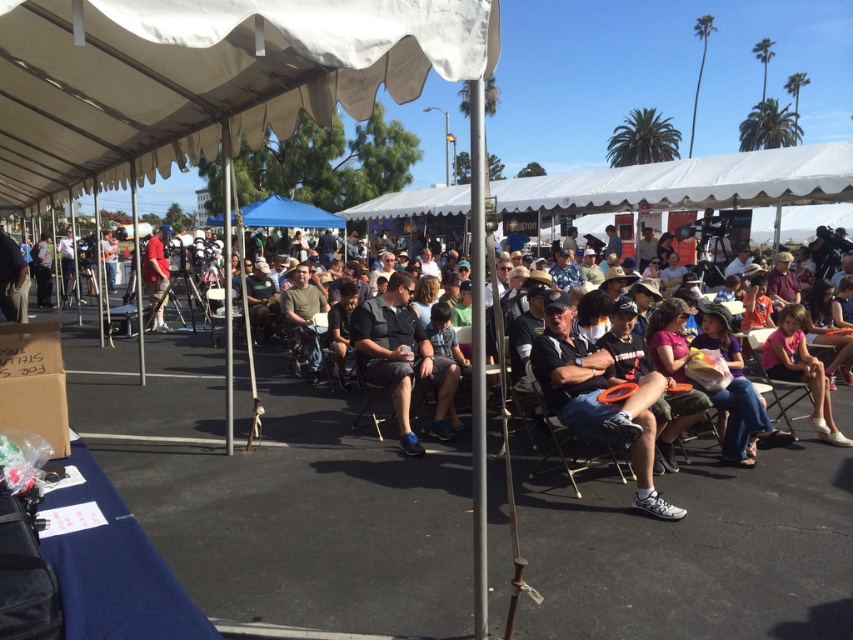
Describe the element at coordinates (401, 356) in the screenshot. I see `dark gray fabric shirt at center` at that location.

Does dark gray fabric shirt at center have a lesser width compared to pink fabric dress at center?

In fact, dark gray fabric shirt at center might be wider than pink fabric dress at center.

Which is in front, point (444, 435) or point (782, 336)?

Point (444, 435) is more forward.

I want to click on dark gray fabric shirt at center, so point(401,356).

Is pink fabric dress at center wider than matte red shirt at center?

No.

Is point (822, 426) positioned before point (152, 304)?

Yes, point (822, 426) is closer to viewer.

The height and width of the screenshot is (640, 853). Find the location of `pink fabric dress at center`. pink fabric dress at center is located at coordinates tap(799, 369).

In the scene shown: Which of these two, dark gray fabric shirt at center or matte red shirt at center, stands taller?

With more height is matte red shirt at center.

Which is above, dark gray fabric shirt at center or matte red shirt at center?

Positioned higher is matte red shirt at center.

Locate an element on the screen. The image size is (853, 640). dark gray fabric shirt at center is located at coordinates (401, 356).